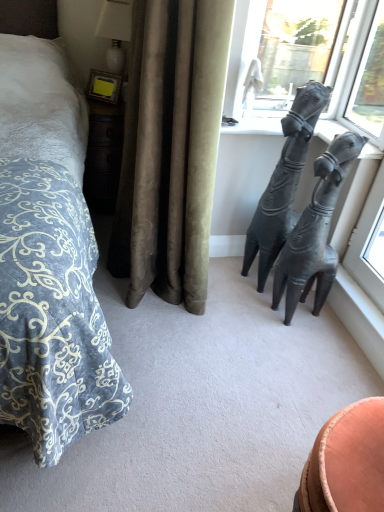
What are the coordinates of `free location in front of black matte sculpture at right, which is the 2th statue (sculpture) from right to left` in the screenshot? It's located at (250, 307).